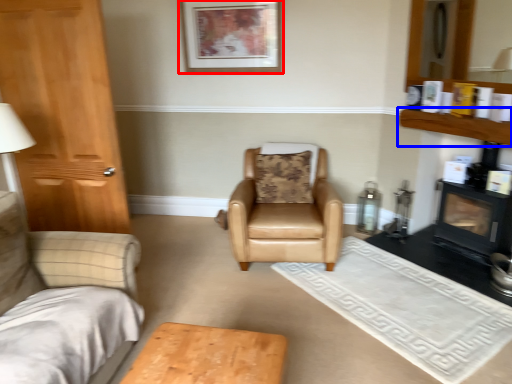
Question: Which of the following is the closest to the observer, picture frame (highlighted by a red box) or shelf (highlighted by a blue box)?

Choices:
 (A) picture frame
 (B) shelf

Answer: (B)